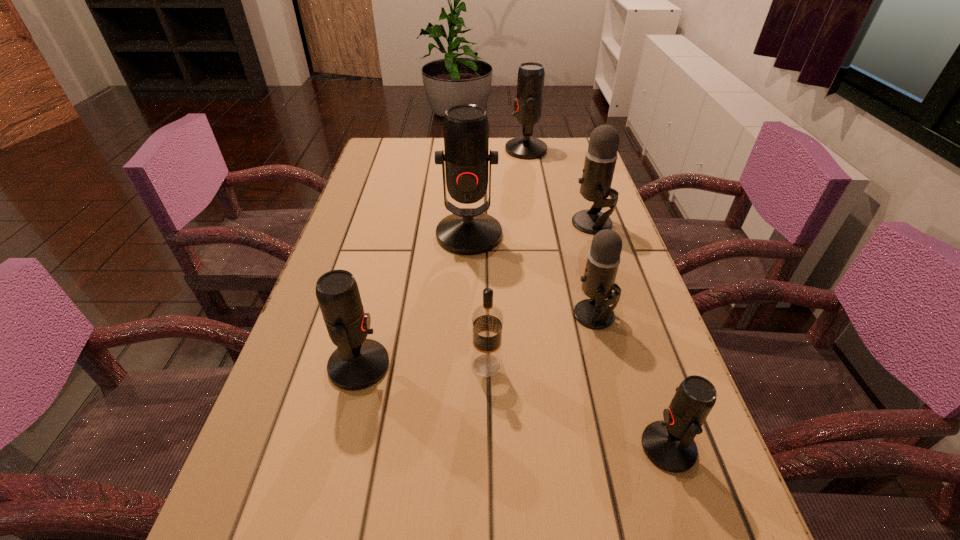
The height and width of the screenshot is (540, 960). In order to click on blank area located on the label of the vodka in this screenshot , I will do click(x=387, y=365).

Locate an element on the screen. vacant area located 0.240m on the label of the vodka is located at coordinates (345, 365).

Locate an element on the screen. blank space located on the side of the nearest microphone with the red ring is located at coordinates (396, 447).

You are a GUI agent. You are given a task and a screenshot of the screen. Output one action in this format:
    pyautogui.click(x=<x>, y=<y>)
    Task: Click on the free point located 0.180m on the side of the nearest microphone with the red ring
    
    Given the screenshot: What is the action you would take?
    click(531, 447)

At what (x,y) coordinates should I click in order to perform the action: click on vacant position located on the side of the nearest microphone with the red ring. Please return your answer as a coordinate pair (x, y). Looking at the image, I should click on (494, 447).

Identify the location of object at the far edge. (530, 84).

You are a GUI agent. You are given a task and a screenshot of the screen. Output one action in this format:
    pyautogui.click(x=<x>, y=<y>)
    Task: Click on the object located at the left edge
    
    Given the screenshot: What is the action you would take?
    pyautogui.click(x=358, y=363)

Identify the location of object present at the far right corner. (530, 84).

In the image, there is a desktop. Identify the location of vacant space at the far edge. The width and height of the screenshot is (960, 540). (499, 139).

The width and height of the screenshot is (960, 540). In the image, there is a desktop. Find the location of `vacant space at the left edge`. vacant space at the left edge is located at coordinates (318, 411).